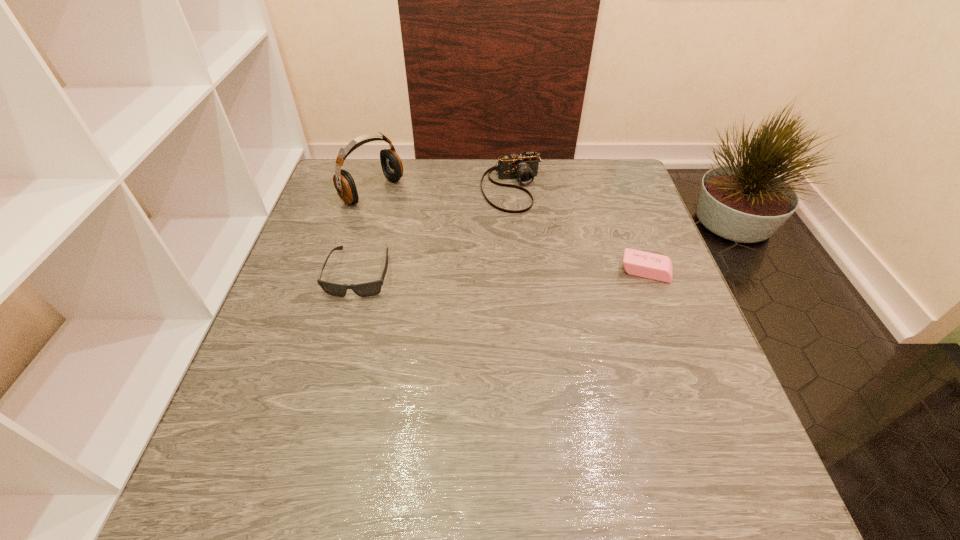
Where is `vacant region at the far edge of the desktop`? The width and height of the screenshot is (960, 540). vacant region at the far edge of the desktop is located at coordinates (432, 174).

In the image, there is a desktop. At what (x,y) coordinates should I click in order to perform the action: click on vacant area at the near edge. Please return your answer as a coordinate pair (x, y). This screenshot has width=960, height=540. Looking at the image, I should click on (452, 418).

Image resolution: width=960 pixels, height=540 pixels. I want to click on vacant space at the left edge, so click(x=356, y=275).

In the image, there is a desktop. Find the location of `free space at the right edge`. free space at the right edge is located at coordinates (694, 348).

The width and height of the screenshot is (960, 540). In the image, there is a desktop. Find the location of `vacant region at the far left corner`. vacant region at the far left corner is located at coordinates (367, 169).

The image size is (960, 540). Identify the location of vacant point at the near left corner. click(x=261, y=430).

The image size is (960, 540). I want to click on free spot at the far right corner of the desktop, so click(x=639, y=196).

Where is `vacant area between the headset and the shortest object`? vacant area between the headset and the shortest object is located at coordinates (509, 231).

Where is `vacant space that's between the tallest object and the sunglasses`? The image size is (960, 540). vacant space that's between the tallest object and the sunglasses is located at coordinates (366, 232).

I want to click on vacant region between the camera and the rightmost object, so click(579, 230).